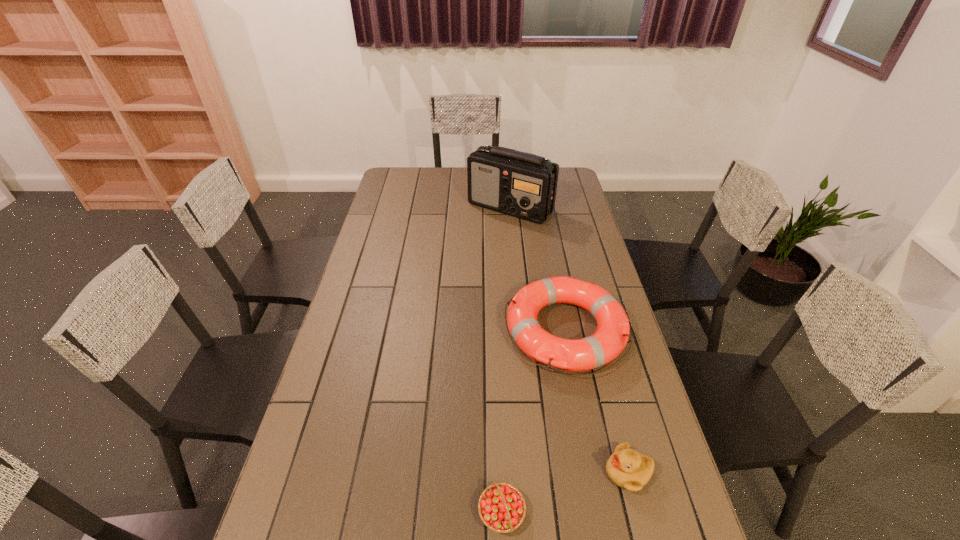
Identify the location of vacant space that satisfies the following two spatial constraints: 1. on the front panel of the third nearest object; 2. on the left side of the tallest object. Image resolution: width=960 pixels, height=540 pixels. (522, 330).

This screenshot has height=540, width=960. In order to click on free region that satisfies the following two spatial constraints: 1. on the front panel of the second farthest object; 2. on the left side of the farthest object in this screenshot , I will do `click(522, 330)`.